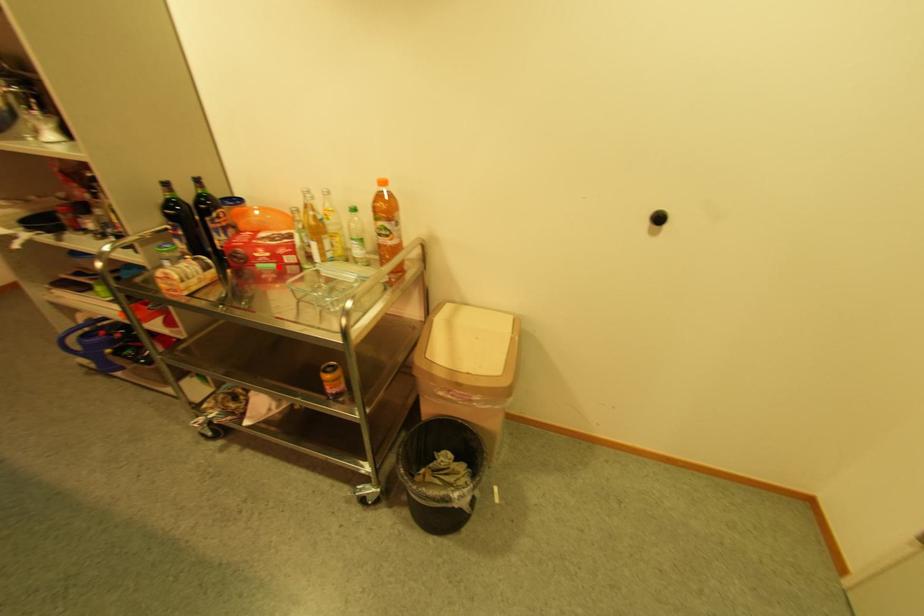
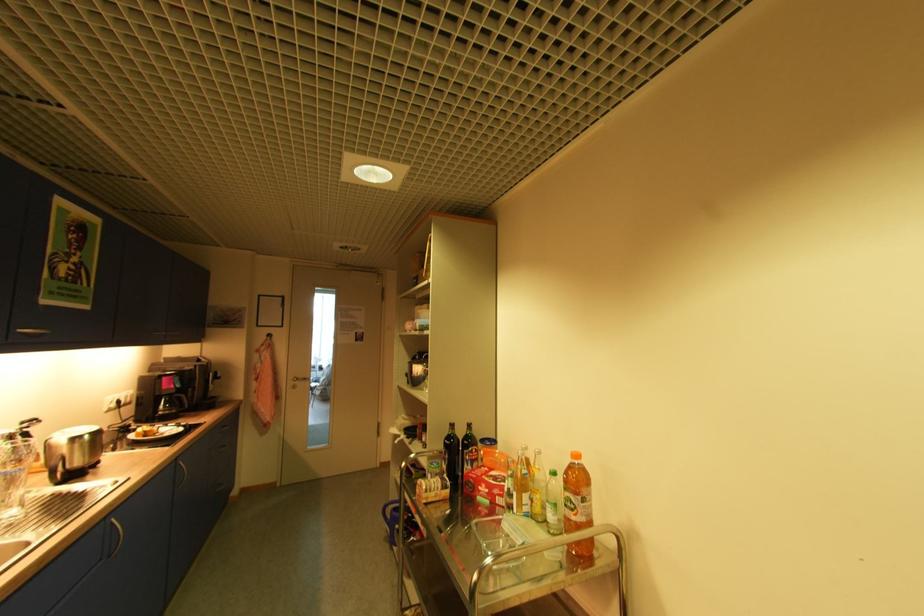
Question: I am providing you with two images of the same scene from different viewpoints. In image1, a red point is highlighted. Considering the same 3D point in image2, which of the following is correct?

Choices:
 (A) It is closer
 (B) It is farther

Answer: (B)